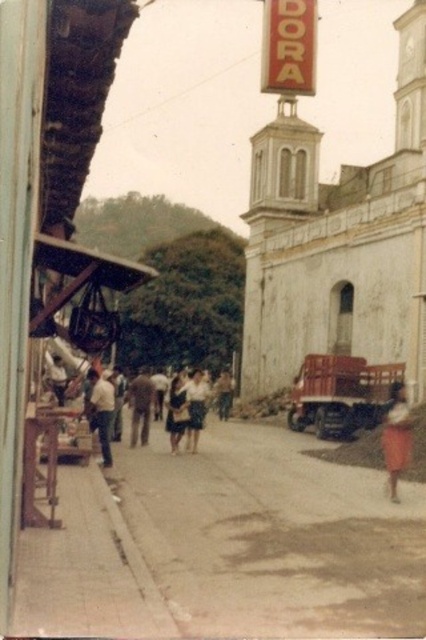
You are a traveler in this historical town and you want to buy a shirt that can cover you better from the sun. Which shirt between the brown fabric shirt at center and the white cotton shirt at center would you choose and why?

The brown fabric shirt at center is bigger than the white cotton shirt at center, so it would provide more coverage from the sun.

You are standing on the street in front of the white building with the bell tower. You notice two points marked in the scene. One is at coordinates point (374, 397) and the other at point (109, 452). Which point is closer to you?

Point (109, 452) is closer to you because it is less further to the camera than point (374, 397).